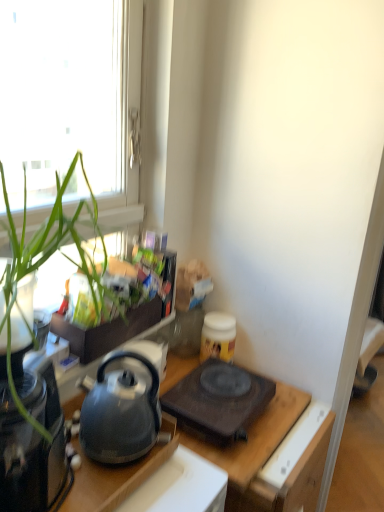
Question: Can you confirm if black matte gas stove at center is positioned to the left of matte black kettle at center?

Choices:
 (A) no
 (B) yes

Answer: (A)

Question: Can we say black matte gas stove at center lies outside matte black kettle at center?

Choices:
 (A) no
 (B) yes

Answer: (B)

Question: Is black matte gas stove at center looking in the opposite direction of matte black kettle at center?

Choices:
 (A) yes
 (B) no

Answer: (B)

Question: Is black matte gas stove at center touching matte black kettle at center?

Choices:
 (A) no
 (B) yes

Answer: (A)

Question: From a real-world perspective, is black matte gas stove at center on matte black kettle at center?

Choices:
 (A) yes
 (B) no

Answer: (A)

Question: From a real-world perspective, is black matte gas stove at center under matte black kettle at center?

Choices:
 (A) yes
 (B) no

Answer: (B)

Question: Could black glass coffee maker at left be considered to be inside green leafy plant at left?

Choices:
 (A) no
 (B) yes

Answer: (A)

Question: Is green leafy plant at left bigger than black glass coffee maker at left?

Choices:
 (A) yes
 (B) no

Answer: (A)

Question: From the image's perspective, is green leafy plant at left on black glass coffee maker at left?

Choices:
 (A) no
 (B) yes

Answer: (B)

Question: From a real-world perspective, is green leafy plant at left beneath black glass coffee maker at left?

Choices:
 (A) no
 (B) yes

Answer: (A)

Question: Does green leafy plant at left have a lesser width compared to black glass coffee maker at left?

Choices:
 (A) yes
 (B) no

Answer: (B)

Question: Does green leafy plant at left have a lesser height compared to black glass coffee maker at left?

Choices:
 (A) yes
 (B) no

Answer: (B)

Question: Is black matte gas stove at center far from green leafy plant at left?

Choices:
 (A) yes
 (B) no

Answer: (B)